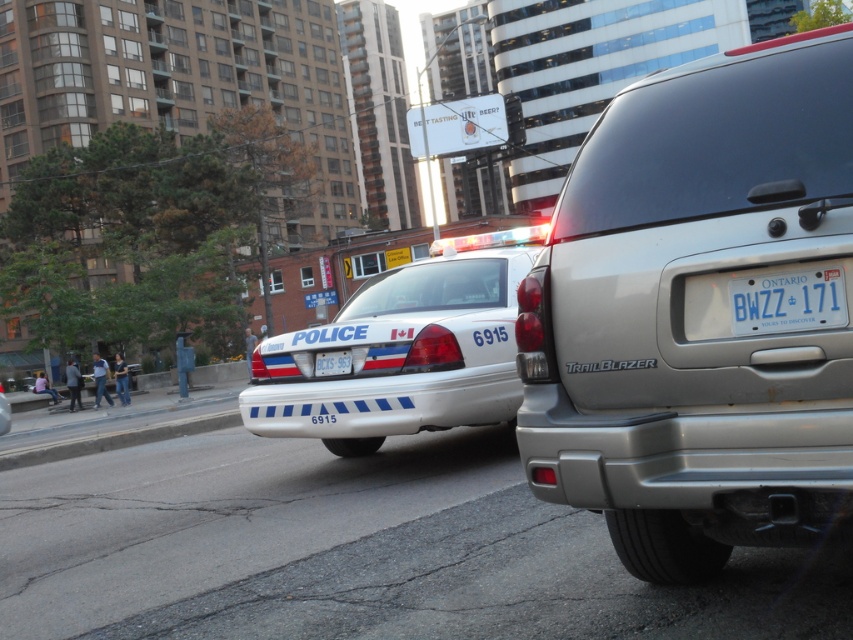
Question: Which of the following is the farthest from the observer?

Choices:
 (A) (778, 310)
 (B) (340, 365)
 (C) (633, 241)
 (D) (416, 321)

Answer: (B)

Question: Is white glossy police car at center below white plastic license plate at rear?

Choices:
 (A) yes
 (B) no

Answer: (B)

Question: Which is nearer to the satin silver suv at center?

Choices:
 (A) white glossy police car at center
 (B) white plastic license plate at rear
 (C) blue plastic license plate at center

Answer: (C)

Question: Is satin silver suv at center bigger than blue plastic license plate at center?

Choices:
 (A) no
 (B) yes

Answer: (B)

Question: Where is white glossy police car at center located in relation to white plastic license plate at rear in the image?

Choices:
 (A) below
 (B) above

Answer: (B)

Question: Which of the following is the closest to the observer?

Choices:
 (A) satin silver suv at center
 (B) white plastic license plate at rear
 (C) white glossy police car at center
 (D) blue plastic license plate at center

Answer: (A)